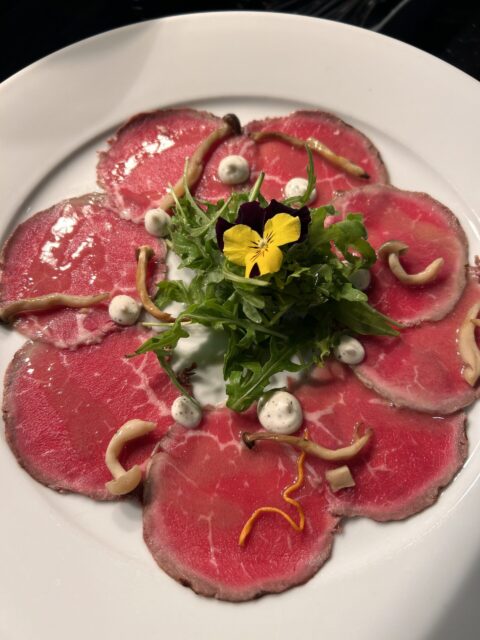
Where is `plate`? This screenshot has width=480, height=640. plate is located at coordinates (437, 164).